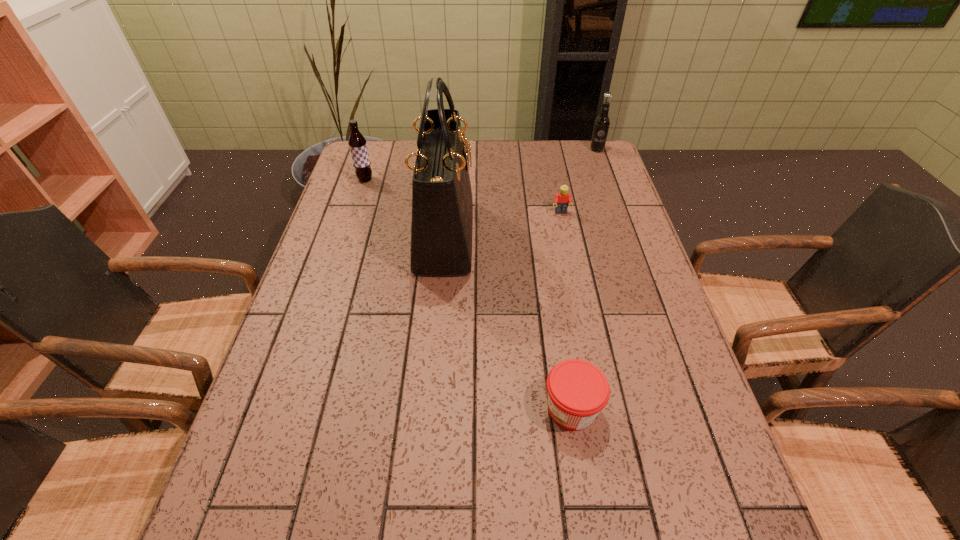
The image size is (960, 540). I want to click on vacant space located on the front of the fourth nearest object, so click(359, 198).

This screenshot has height=540, width=960. In order to click on vacant region located on the label side of the jam in this screenshot , I will do `click(424, 409)`.

Where is `free region located 0.120m on the label side of the jam`? free region located 0.120m on the label side of the jam is located at coordinates (483, 409).

You are a GUI agent. You are given a task and a screenshot of the screen. Output one action in this format:
    pyautogui.click(x=<x>, y=<y>)
    Task: Click on the vacant space located on the label side of the jam
    This screenshot has width=960, height=540.
    Given the screenshot: What is the action you would take?
    pyautogui.click(x=464, y=409)

The image size is (960, 540). In order to click on free space located on the face of the Lego in this screenshot , I will do `click(565, 235)`.

The image size is (960, 540). In order to click on object located in the left edge section of the desktop in this screenshot , I will do `click(357, 143)`.

What are the coordinates of `object that is positioned at the right edge` in the screenshot? It's located at (601, 126).

At what (x,y) coordinates should I click in order to perform the action: click on object at the far left corner. Please return your answer as a coordinate pair (x, y). The width and height of the screenshot is (960, 540). Looking at the image, I should click on (357, 143).

Find the location of a particular element. The height and width of the screenshot is (540, 960). object present at the far right corner is located at coordinates 601,126.

Identify the location of free space at the far edge. (411, 173).